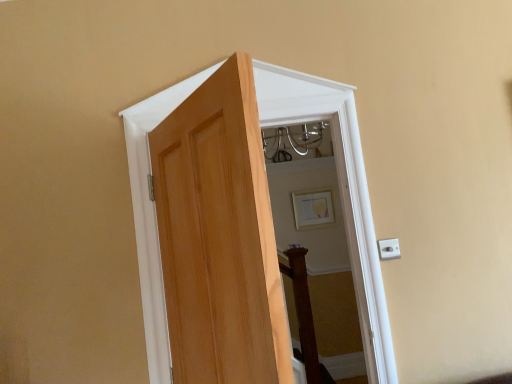
Question: From the image's perspective, is natural wood door at center on white plastic electric outlet at right?

Choices:
 (A) yes
 (B) no

Answer: (A)

Question: Is white plastic electric outlet at right completely or partially inside natural wood door at center?

Choices:
 (A) no
 (B) yes

Answer: (A)

Question: Does natural wood door at center have a smaller size compared to white plastic electric outlet at right?

Choices:
 (A) no
 (B) yes

Answer: (A)

Question: Would you say natural wood door at center is outside white plastic electric outlet at right?

Choices:
 (A) no
 (B) yes

Answer: (B)

Question: Considering the relative positions of natural wood door at center and white plastic electric outlet at right in the image provided, is natural wood door at center to the right of white plastic electric outlet at right from the viewer's perspective?

Choices:
 (A) no
 (B) yes

Answer: (A)

Question: From a real-world perspective, is natural wood door at center under white plastic electric outlet at right?

Choices:
 (A) yes
 (B) no

Answer: (B)

Question: Is natural wood door at center next to matte gold picture frame at upper center and touching it?

Choices:
 (A) no
 (B) yes

Answer: (A)

Question: Does natural wood door at center have a greater height compared to matte gold picture frame at upper center?

Choices:
 (A) yes
 (B) no

Answer: (A)

Question: Would you say natural wood door at center is a long distance from matte gold picture frame at upper center?

Choices:
 (A) yes
 (B) no

Answer: (A)

Question: Is natural wood door at center positioned before matte gold picture frame at upper center?

Choices:
 (A) no
 (B) yes

Answer: (B)

Question: From a real-world perspective, is natural wood door at center positioned over matte gold picture frame at upper center based on gravity?

Choices:
 (A) yes
 (B) no

Answer: (B)

Question: Is natural wood door at center oriented away from matte gold picture frame at upper center?

Choices:
 (A) no
 (B) yes

Answer: (B)

Question: Can we say white plastic electric outlet at right lies outside matte gold picture frame at upper center?

Choices:
 (A) yes
 (B) no

Answer: (A)